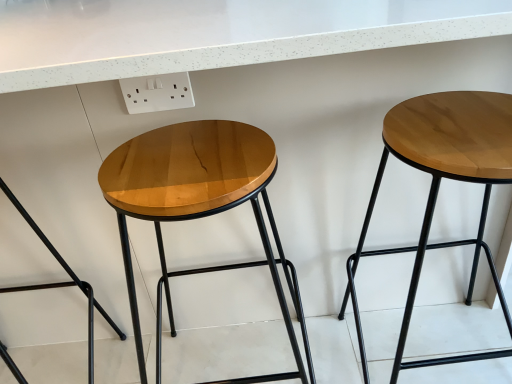
Question: From a real-world perspective, is wooden/marbled stool at left, positioned as the 3th stool in right-to-left order, physically below white plastic outlet at upper center?

Choices:
 (A) no
 (B) yes

Answer: (B)

Question: Is the position of wooden/marbled stool at left, positioned as the 3th stool in right-to-left order, less distant than that of white plastic outlet at upper center?

Choices:
 (A) no
 (B) yes

Answer: (B)

Question: From the image's perspective, is wooden/marbled stool at left, positioned as the 3th stool in right-to-left order, on white plastic outlet at upper center?

Choices:
 (A) yes
 (B) no

Answer: (B)

Question: Can you confirm if wooden/marbled stool at left, which appears as the 1th stool when viewed from the left, is bigger than white plastic outlet at upper center?

Choices:
 (A) no
 (B) yes

Answer: (B)

Question: Can you confirm if wooden/marbled stool at left, positioned as the 3th stool in right-to-left order, is thinner than white plastic outlet at upper center?

Choices:
 (A) yes
 (B) no

Answer: (B)

Question: Is wooden/marbled stool at left, positioned as the 3th stool in right-to-left order, taller than white plastic outlet at upper center?

Choices:
 (A) no
 (B) yes

Answer: (B)

Question: Are wooden stool at center, which is the second stool from right to left, and wooden/marbled stool at left, positioned as the 3th stool in right-to-left order, far apart?

Choices:
 (A) yes
 (B) no

Answer: (B)

Question: Is wooden stool at center, which is the second stool from right to left, behind wooden/marbled stool at left, positioned as the 3th stool in right-to-left order?

Choices:
 (A) no
 (B) yes

Answer: (A)

Question: Is wooden stool at center, which is the second stool from left to right, at the right side of wooden/marbled stool at left, positioned as the 3th stool in right-to-left order?

Choices:
 (A) yes
 (B) no

Answer: (A)

Question: Considering the relative sizes of wooden stool at center, which is the second stool from left to right, and wooden/marbled stool at left, positioned as the 3th stool in right-to-left order, in the image provided, is wooden stool at center, which is the second stool from left to right, smaller than wooden/marbled stool at left, positioned as the 3th stool in right-to-left order,?

Choices:
 (A) no
 (B) yes

Answer: (A)

Question: Is wooden stool at center, which is the second stool from left to right, taller than wooden/marbled stool at left, which appears as the 1th stool when viewed from the left?

Choices:
 (A) yes
 (B) no

Answer: (B)

Question: Is wooden stool at center, which is the second stool from left to right, located outside wooden/marbled stool at left, which appears as the 1th stool when viewed from the left?

Choices:
 (A) yes
 (B) no

Answer: (A)

Question: Is wooden stool at right, the third stool in the left-to-right sequence, facing towards wooden/marbled stool at left, positioned as the 3th stool in right-to-left order?

Choices:
 (A) yes
 (B) no

Answer: (B)